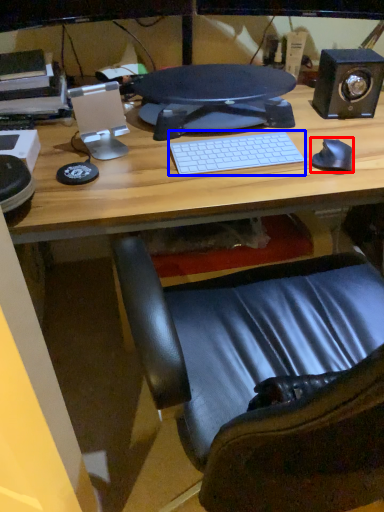
Question: Which point is closer to the camera, mouse (highlighted by a red box) or computer keyboard (highlighted by a blue box)?

Choices:
 (A) mouse
 (B) computer keyboard

Answer: (A)